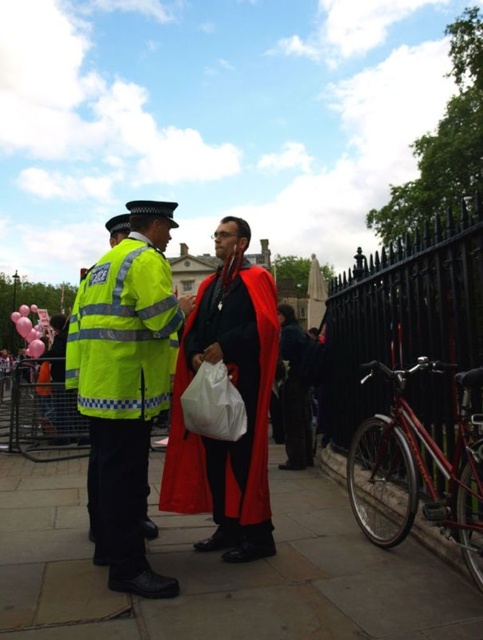
From the picture: You are a pedestrian trying to cross the street and see the high visibility yellow jacket at left and the slate gray stone pavement at center. Which object is closer to the ground?

The slate gray stone pavement at center has a lesser height compared to the high visibility yellow jacket at left, so the slate gray stone pavement at center is closer to the ground.

You are a delivery person trying to place a large package on the ground. The package is wider than the high visibility yellow jacket at left. Can you place it on the slate gray stone pavement at center without overlapping the jacket?

The slate gray stone pavement at center is wider than the high visibility yellow jacket at left. Since the package is wider than the jacket, it can fit on the pavement as long as it is placed within the pavement area without overlapping the jacket.